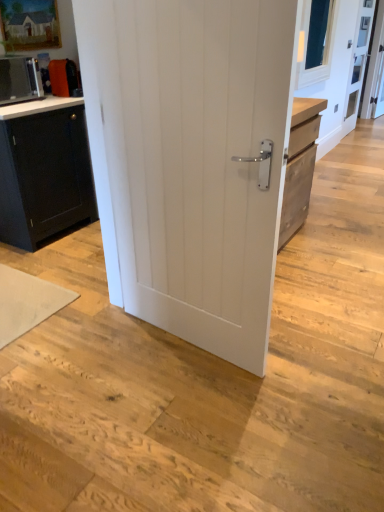
Question: In terms of size, does white painted wood door at center appear bigger or smaller than matte black microwave at left?

Choices:
 (A) small
 (B) big

Answer: (B)

Question: From their relative heights in the image, would you say white painted wood door at center is taller or shorter than matte black microwave at left?

Choices:
 (A) short
 (B) tall

Answer: (B)

Question: Which object is the farthest from the clear glass window screen at upper right?

Choices:
 (A) white painted wood door at center
 (B) matte black cabinet at left
 (C) clear glass screen door at upper right
 (D) white glossy countertop at upper left
 (E) white matte yoga mat at lower left

Answer: (E)

Question: Based on their relative distances, which object is farther from the white glossy countertop at upper left?

Choices:
 (A) clear glass window screen at upper right
 (B) clear glass screen door at upper right
 (C) white matte yoga mat at lower left
 (D) white painted wood door at center
 (E) matte black microwave at left

Answer: (B)